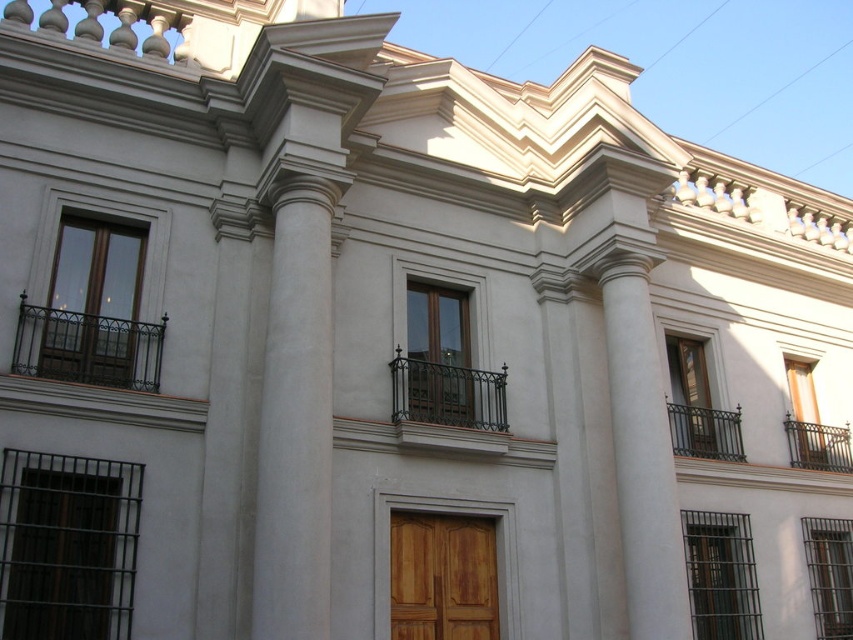
You are an architect evaluating the building facade. You notice the wooden at center and the green wrought iron balcony at lower right. Which of these two elements has a greater height?

The green wrought iron balcony at lower right has a greater height compared to the wooden at center.

You are an architect planning to install a new decorative element on the facade of the classical building. The wooden at center has a width that is less than the green wrought iron balcony at lower right. Which object should you choose to place a wider decorative element on, considering their widths?

You should place the wider decorative element on the green wrought iron balcony at lower right because its width is greater than the wooden at center.